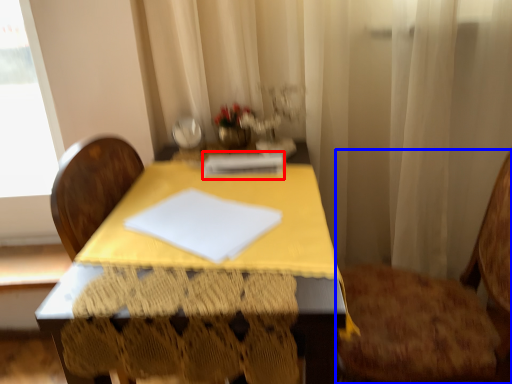
Question: Which object is closer to the camera taking this photo, notebook (highlighted by a red box) or chair (highlighted by a blue box)?

Choices:
 (A) notebook
 (B) chair

Answer: (B)